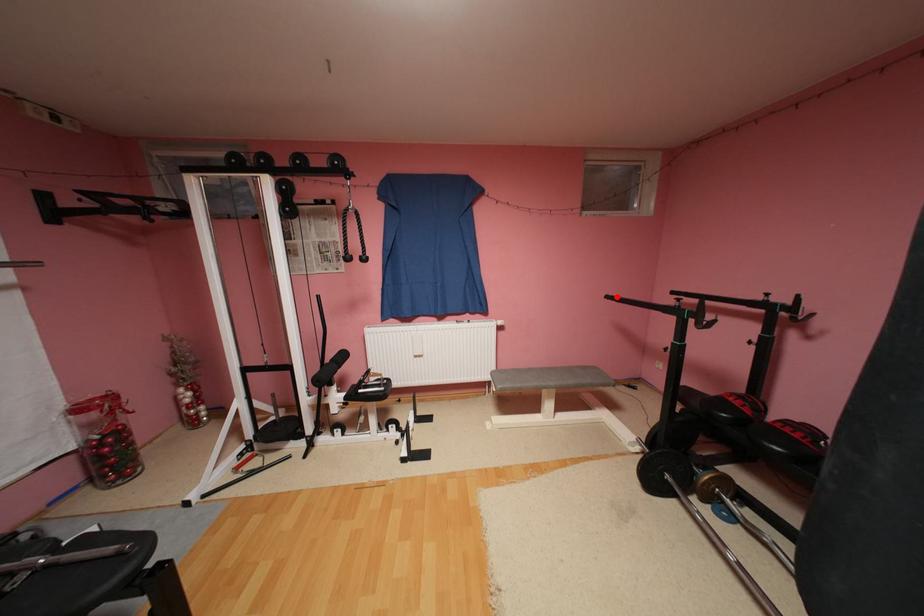
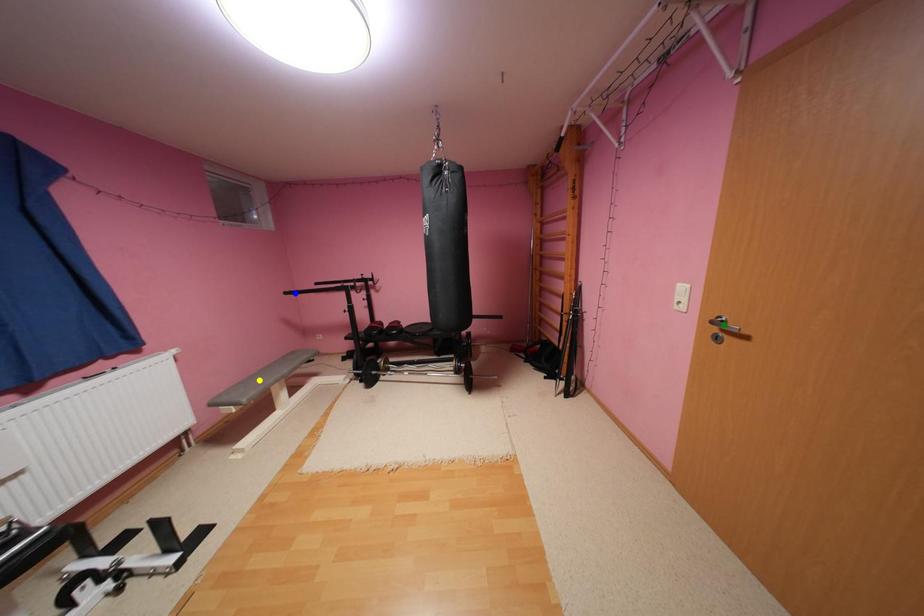
Question: I am providing you with two images of the same scene from different viewpoints. A red point is marked on the first image. You are given multiple points on the second image. Which mark in image 2 goes with the point in image 1?

Choices:
 (A) green point
 (B) blue point
 (C) yellow point

Answer: (B)